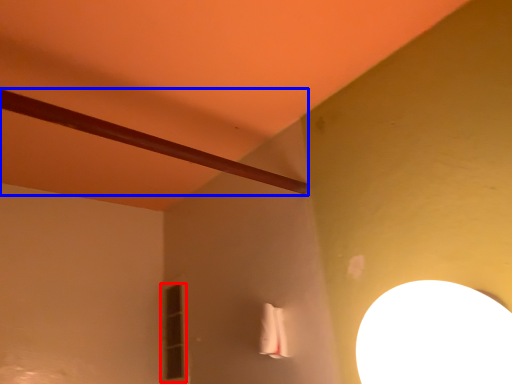
Question: Which point is closer to the camera, window (highlighted by a red box) or beam (highlighted by a blue box)?

Choices:
 (A) window
 (B) beam

Answer: (B)